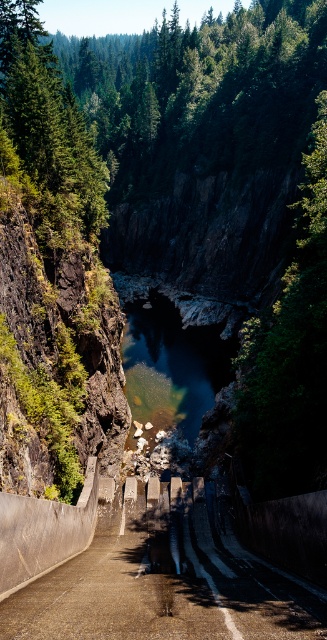
Question: Can you confirm if concrete steps at center is bigger than clear blue water at center?

Choices:
 (A) no
 (B) yes

Answer: (A)

Question: Which point is closer to the camera?

Choices:
 (A) clear blue water at center
 (B) concrete steps at center

Answer: (B)

Question: Which point is closer to the camera taking this photo?

Choices:
 (A) (243, 596)
 (B) (158, 339)

Answer: (A)

Question: Which point appears closest to the camera in this image?

Choices:
 (A) (57, 604)
 (B) (199, 420)

Answer: (A)

Question: Is the position of concrete steps at center more distant than that of clear blue water at center?

Choices:
 (A) no
 (B) yes

Answer: (A)

Question: Is concrete steps at center to the right of clear blue water at center from the viewer's perspective?

Choices:
 (A) yes
 (B) no

Answer: (B)